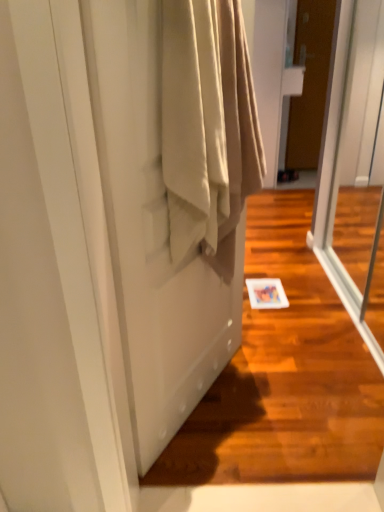
Question: Can you confirm if transparent glass screen door at right, which is counted as the first screen door, starting from the right, is wider than satin beige curtain at lower left, arranged as the 2th screen door when viewed from the right?

Choices:
 (A) yes
 (B) no

Answer: (A)

Question: Is transparent glass screen door at right, which is counted as the first screen door, starting from the right, bigger than satin beige curtain at lower left, the 1th screen door from the left?

Choices:
 (A) yes
 (B) no

Answer: (A)

Question: Considering the relative positions of transparent glass screen door at right, arranged as the 2th screen door when viewed from the left, and satin beige curtain at lower left, the 1th screen door from the left, in the image provided, is transparent glass screen door at right, arranged as the 2th screen door when viewed from the left, to the right of satin beige curtain at lower left, the 1th screen door from the left, from the viewer's perspective?

Choices:
 (A) yes
 (B) no

Answer: (A)

Question: From a real-world perspective, is transparent glass screen door at right, arranged as the 2th screen door when viewed from the left, positioned over satin beige curtain at lower left, the 1th screen door from the left, based on gravity?

Choices:
 (A) no
 (B) yes

Answer: (B)

Question: Does transparent glass screen door at right, which is counted as the first screen door, starting from the right, lie behind satin beige curtain at lower left, the 1th screen door from the left?

Choices:
 (A) no
 (B) yes

Answer: (B)

Question: Is satin beige curtain at lower left, the 1th screen door from the left, taller or shorter than brown matte door at upper right?

Choices:
 (A) short
 (B) tall

Answer: (A)

Question: Is satin beige curtain at lower left, the 1th screen door from the left, wider or thinner than brown matte door at upper right?

Choices:
 (A) thin
 (B) wide

Answer: (A)

Question: Based on their sizes in the image, would you say satin beige curtain at lower left, arranged as the 2th screen door when viewed from the right, is bigger or smaller than brown matte door at upper right?

Choices:
 (A) small
 (B) big

Answer: (B)

Question: Is point (127, 175) positioned closer to the camera than point (304, 98)?

Choices:
 (A) farther
 (B) closer

Answer: (B)

Question: Choose the correct answer: Is brown matte door at upper right inside satin beige curtain at lower left, the 1th screen door from the left, or outside it?

Choices:
 (A) inside
 (B) outside

Answer: (B)

Question: In the image, is brown matte door at upper right on the left side or the right side of satin beige curtain at lower left, arranged as the 2th screen door when viewed from the right?

Choices:
 (A) left
 (B) right

Answer: (B)

Question: Considering the positions of brown matte door at upper right and satin beige curtain at lower left, the 1th screen door from the left, in the image, is brown matte door at upper right taller or shorter than satin beige curtain at lower left, the 1th screen door from the left,?

Choices:
 (A) short
 (B) tall

Answer: (B)

Question: Is point (292, 163) positioned closer to the camera than point (148, 167)?

Choices:
 (A) closer
 (B) farther

Answer: (B)

Question: Considering the positions of transparent glass screen door at right, arranged as the 2th screen door when viewed from the left, and beige fabric at center in the image, is transparent glass screen door at right, arranged as the 2th screen door when viewed from the left, taller or shorter than beige fabric at center?

Choices:
 (A) tall
 (B) short

Answer: (A)

Question: From a real-world perspective, relative to beige fabric at center, is transparent glass screen door at right, arranged as the 2th screen door when viewed from the left, vertically above or below?

Choices:
 (A) below
 (B) above

Answer: (A)